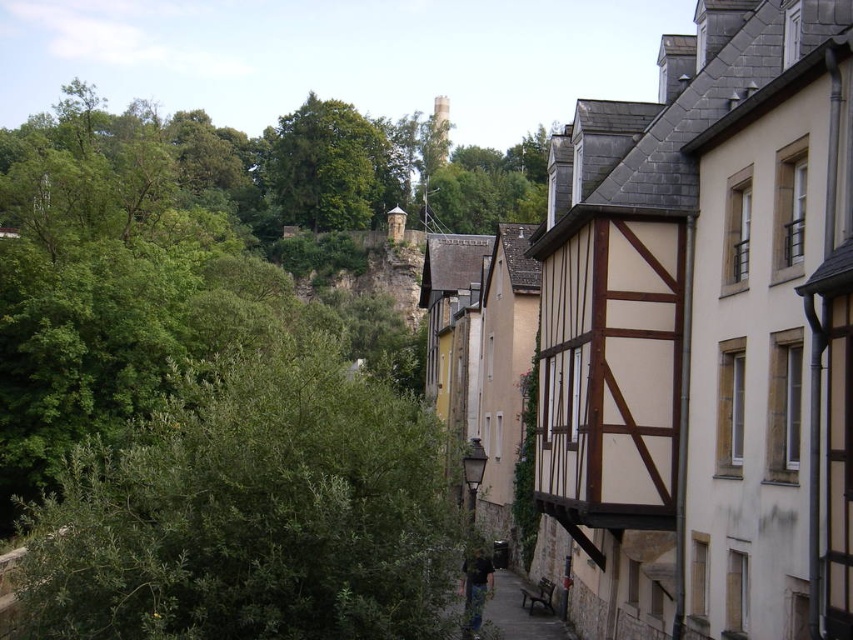
You are a landscape architect designing a garden path between the green leafy bush at left and the green leafy tree at upper center. Which plant should you consider for a larger planting area?

The green leafy tree at upper center requires a larger planting area because it occupies more space than the green leafy bush at left.

You are standing on a narrow historic street surrounded by half timbered buildings. You see two points marked on the ground, one at coordinates point (332,625) and another at point (390,148). Which point is closer to you?

Point (332,625) is closer to the viewer than point (390,148).